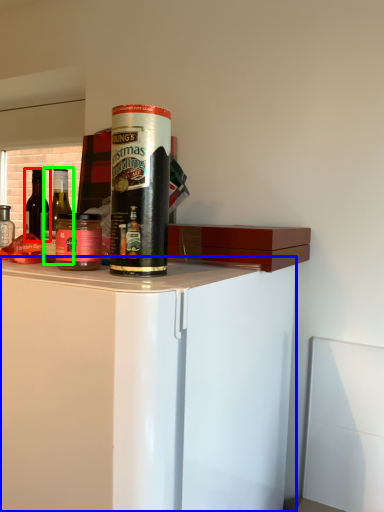
Question: Which is nearer to the bottle (highlighted by a red box)? cabinetry (highlighted by a blue box) or bottle (highlighted by a green box).

Choices:
 (A) cabinetry
 (B) bottle

Answer: (A)